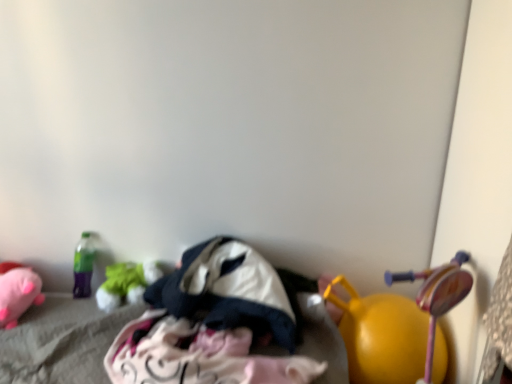
Question: Is yellow rubber ball at lower right, arranged as the 3th toy when viewed from the left, in front of or behind dark blue fabric at center, acting as the 2th clothing starting from the bottom, in the image?

Choices:
 (A) behind
 (B) front

Answer: (B)

Question: Considering the positions of point (394, 364) and point (286, 309), is point (394, 364) closer or farther from the camera than point (286, 309)?

Choices:
 (A) closer
 (B) farther

Answer: (A)

Question: Which of these objects is positioned closest to the yellow rubber ball at lower right, arranged as the 3th toy when viewed from the left?

Choices:
 (A) soft pink plush at lower left, the first toy from the left
 (B) white cotton clothes at center, marked as the 2th clothing in a top-to-bottom arrangement
 (C) dark blue fabric at center, the first clothing when ordered from top to bottom
 (D) green fabric toy at left, which is the 2th toy from left to right

Answer: (C)

Question: Estimate the real-world distances between objects in this image. Which object is farther from the soft pink plush at lower left, the first toy from the left?

Choices:
 (A) dark blue fabric at center, acting as the 2th clothing starting from the bottom
 (B) yellow rubber ball at lower right, placed as the first toy when sorted from right to left
 (C) white cotton clothes at center, which appears as the first clothing when ordered from the bottom
 (D) green fabric toy at left, which is the 2th toy from left to right

Answer: (B)